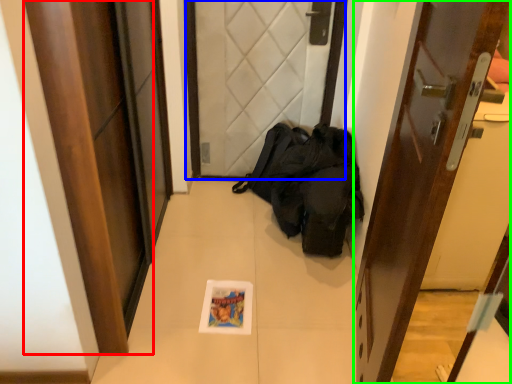
Question: Considering the real-world distances, which object is farthest from door (highlighted by a red box)? door (highlighted by a blue box) or door (highlighted by a green box)?

Choices:
 (A) door
 (B) door

Answer: (A)